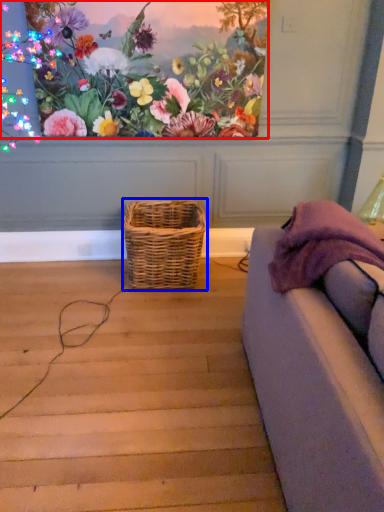
Question: Which object is closer to the camera taking this photo, flower (highlighted by a red box) or picnic basket (highlighted by a blue box)?

Choices:
 (A) flower
 (B) picnic basket

Answer: (A)